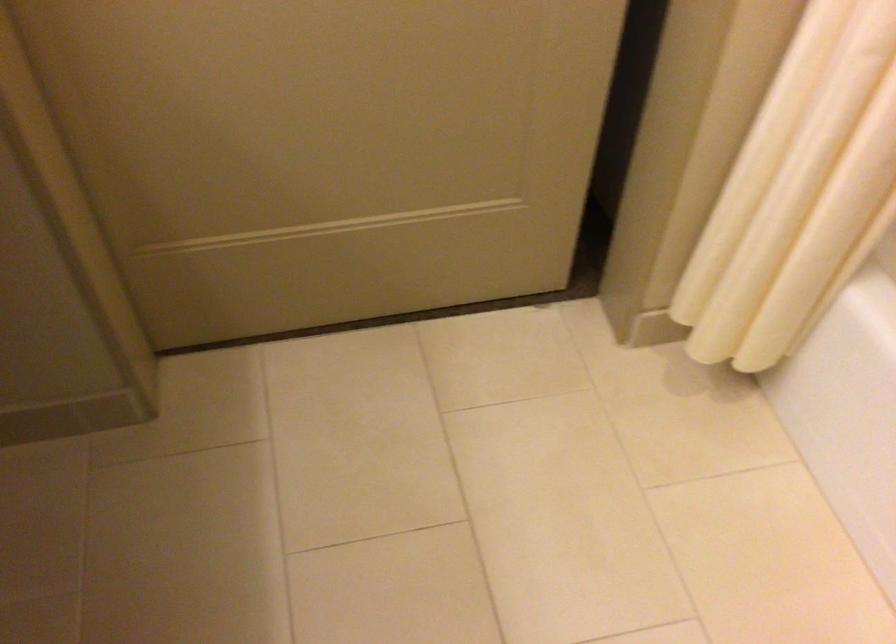
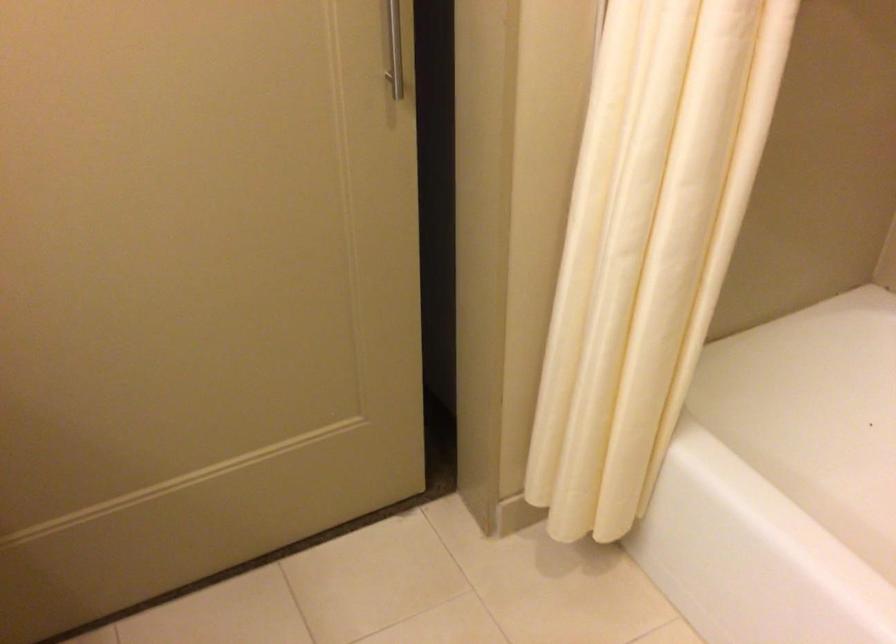
Which direction would the cameraman need to move to produce the second image?

The movement direction of the cameraman is right, backward.